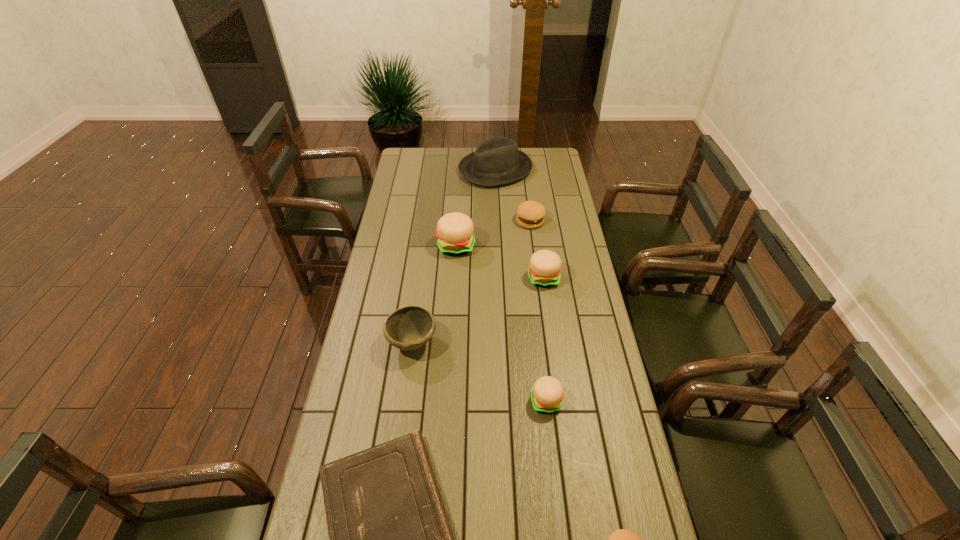
Select which object is the fourth closest to the third farthest hamburger. Please provide its 2D coordinates. Your answer should be formatted as a tuple, i.e. [(x, y)], where the tuple contains the x and y coordinates of a point satisfying the conditions above.

[(547, 394)]

Locate an element on the screen. This screenshot has width=960, height=540. the closest object to the farthest hamburger is located at coordinates (454, 230).

Locate an element on the screen. This screenshot has width=960, height=540. the second closest hamburger relative to the nearer brown hamburger is located at coordinates (545, 266).

Locate an element on the screen. hamburger object that ranks as the fourth closest to the shortest hamburger is located at coordinates (530, 214).

Locate which beige hamburger ranks in proximity to the third nearest object. Please provide its 2D coordinates. Your answer should be formatted as a tuple, i.e. [(x, y)], where the tuple contains the x and y coordinates of a point satisfying the conditions above.

[(545, 266)]

Select which beige hamburger appears as the second closest to the farthest hamburger. Please provide its 2D coordinates. Your answer should be formatted as a tuple, i.e. [(x, y)], where the tuple contains the x and y coordinates of a point satisfying the conditions above.

[(545, 266)]